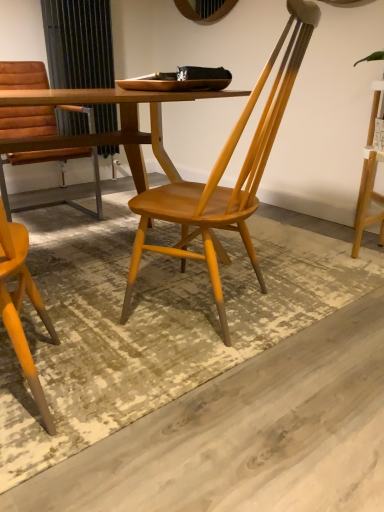
Question: Is matte brown leather chair at left, which is the 1th chair from left to right, looking in the opposite direction of wooden chair at center, which is the first chair in front-to-back order?

Choices:
 (A) no
 (B) yes

Answer: (A)

Question: Does matte brown leather chair at left, acting as the 1th chair starting from the back, have a smaller size compared to wooden chair at center, placed as the 2th chair when sorted from left to right?

Choices:
 (A) no
 (B) yes

Answer: (A)

Question: From the image's perspective, is matte brown leather chair at left, acting as the 2th chair starting from the right, on top of wooden chair at center, acting as the 1th chair starting from the right?

Choices:
 (A) yes
 (B) no

Answer: (A)

Question: Is matte brown leather chair at left, acting as the 2th chair starting from the right, outside wooden chair at center, which is the first chair in front-to-back order?

Choices:
 (A) no
 (B) yes

Answer: (B)

Question: Is matte brown leather chair at left, the 2th chair in the front-to-back sequence, far from wooden chair at center, arranged as the 2th chair when viewed from the back?

Choices:
 (A) yes
 (B) no

Answer: (A)

Question: From a real-world perspective, is wooden chair at center, which is the first chair in front-to-back order, physically located above or below wooden table at center?

Choices:
 (A) above
 (B) below

Answer: (A)

Question: Visually, is wooden chair at center, placed as the 2th chair when sorted from left to right, positioned to the left or to the right of wooden table at center?

Choices:
 (A) right
 (B) left

Answer: (A)

Question: In terms of size, does wooden chair at center, which is the first chair in front-to-back order, appear bigger or smaller than wooden table at center?

Choices:
 (A) small
 (B) big

Answer: (A)

Question: From the image's perspective, relative to wooden table at center, is wooden chair at center, placed as the 2th chair when sorted from left to right, above or below?

Choices:
 (A) below
 (B) above

Answer: (A)

Question: Which is correct: matte brown leather chair at left, acting as the 2th chair starting from the right, is inside wooden table at center, or outside of it?

Choices:
 (A) outside
 (B) inside

Answer: (A)

Question: Is matte brown leather chair at left, the 2th chair in the front-to-back sequence, taller or shorter than wooden table at center?

Choices:
 (A) short
 (B) tall

Answer: (B)

Question: In terms of width, does matte brown leather chair at left, which is the 1th chair from left to right, look wider or thinner when compared to wooden table at center?

Choices:
 (A) thin
 (B) wide

Answer: (A)

Question: Based on their sizes in the image, would you say matte brown leather chair at left, the 2th chair in the front-to-back sequence, is bigger or smaller than wooden table at center?

Choices:
 (A) big
 (B) small

Answer: (B)

Question: From a real-world perspective, relative to matte brown leather chair at left, the 2th chair in the front-to-back sequence, is wooden chair at center, placed as the 2th chair when sorted from left to right, vertically above or below?

Choices:
 (A) below
 (B) above

Answer: (B)

Question: Is wooden chair at center, arranged as the 2th chair when viewed from the back, in front of or behind matte brown leather chair at left, acting as the 2th chair starting from the right, in the image?

Choices:
 (A) front
 (B) behind

Answer: (A)